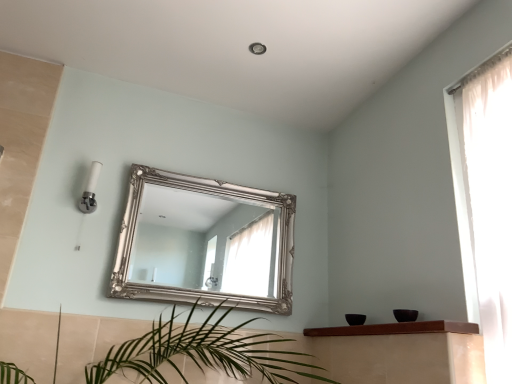
Describe the element at coordinates (205, 243) in the screenshot. I see `silver ornate mirror at center` at that location.

Find the location of a particular element. This screenshot has height=384, width=512. silver ornate mirror at center is located at coordinates (205, 243).

The height and width of the screenshot is (384, 512). What do you see at coordinates (396, 329) in the screenshot? I see `brown wooden shelf at lower center` at bounding box center [396, 329].

At what (x,y) coordinates should I click in order to perform the action: click on brown wooden shelf at lower center. Please return your answer as a coordinate pair (x, y). Looking at the image, I should click on (396, 329).

The width and height of the screenshot is (512, 384). Identify the location of silver ornate mirror at center. (205, 243).

Which object is positioned more to the left, silver ornate mirror at center or brown wooden shelf at lower center?

From the viewer's perspective, silver ornate mirror at center appears more on the left side.

Considering their positions, is silver ornate mirror at center located in front of or behind brown wooden shelf at lower center?

silver ornate mirror at center is behind brown wooden shelf at lower center.

Is point (153, 224) closer or farther from the camera than point (459, 332)?

Clearly, point (153, 224) is more distant from the camera than point (459, 332).

From the image's perspective, would you say silver ornate mirror at center is shown under brown wooden shelf at lower center?

→ No, from the image's perspective, silver ornate mirror at center is not beneath brown wooden shelf at lower center.

From a real-world perspective, between silver ornate mirror at center and brown wooden shelf at lower center, who is vertically lower?

brown wooden shelf at lower center, from a real-world perspective.

Between silver ornate mirror at center and brown wooden shelf at lower center, which one has smaller width?

silver ornate mirror at center is thinner.

Looking at this image, is silver ornate mirror at center taller or shorter than brown wooden shelf at lower center?

Clearly, silver ornate mirror at center is taller compared to brown wooden shelf at lower center.

Considering the relative sizes of silver ornate mirror at center and brown wooden shelf at lower center in the image provided, is silver ornate mirror at center bigger than brown wooden shelf at lower center?

Yes.

Is brown wooden shelf at lower center completely or partially inside silver ornate mirror at center?

Definitely not — brown wooden shelf at lower center is not inside silver ornate mirror at center.

Can you see silver ornate mirror at center touching brown wooden shelf at lower center?

No, silver ornate mirror at center is not with brown wooden shelf at lower center.

Is silver ornate mirror at center turned away from brown wooden shelf at lower center?

silver ornate mirror at center does not have its back to brown wooden shelf at lower center.

How many degrees apart are the facing directions of silver ornate mirror at center and brown wooden shelf at lower center?

The facing directions of silver ornate mirror at center and brown wooden shelf at lower center are 89 degrees apart.

Locate an element on the screen. This screenshot has height=384, width=512. mirror that is on the left side of brown wooden shelf at lower center is located at coordinates (205, 243).

Considering the relative positions of brown wooden shelf at lower center and silver ornate mirror at center in the image provided, is brown wooden shelf at lower center to the right of silver ornate mirror at center from the viewer's perspective?

Yes.

From the picture: Is the depth of brown wooden shelf at lower center greater than that of silver ornate mirror at center?

No, it is not.

Considering the points (409, 327) and (181, 196), which point is behind, point (409, 327) or point (181, 196)?

Positioned behind is point (181, 196).

From the image's perspective, would you say brown wooden shelf at lower center is positioned over silver ornate mirror at center?

No, from the image's perspective, brown wooden shelf at lower center is not on top of silver ornate mirror at center.

From a real-world perspective, is brown wooden shelf at lower center on silver ornate mirror at center?

Actually, brown wooden shelf at lower center is physically below silver ornate mirror at center in the real world.

Considering the sizes of objects brown wooden shelf at lower center and silver ornate mirror at center in the image provided, who is wider, brown wooden shelf at lower center or silver ornate mirror at center?

brown wooden shelf at lower center.

Who is taller, brown wooden shelf at lower center or silver ornate mirror at center?

Standing taller between the two is silver ornate mirror at center.

Is brown wooden shelf at lower center smaller than silver ornate mirror at center?

Correct, brown wooden shelf at lower center occupies less space than silver ornate mirror at center.

Would you say brown wooden shelf at lower center is inside or outside silver ornate mirror at center?

The correct answer is: outside.

Are brown wooden shelf at lower center and silver ornate mirror at center far apart?

Yes.

Is brown wooden shelf at lower center looking in the opposite direction of silver ornate mirror at center?

brown wooden shelf at lower center is not turned away from silver ornate mirror at center.

What's the angular difference between brown wooden shelf at lower center and silver ornate mirror at center's facing directions?

89 degrees.

You are a GUI agent. You are given a task and a screenshot of the screen. Output one action in this format:
    pyautogui.click(x=<x>, y=<y>)
    Task: Click on the balustrade in front of the silver ornate mirror at center
    The height and width of the screenshot is (384, 512).
    Given the screenshot: What is the action you would take?
    pyautogui.click(x=396, y=329)

Locate an element on the screen. balustrade beneath the silver ornate mirror at center (from a real-world perspective) is located at coordinates (396, 329).

The width and height of the screenshot is (512, 384). I want to click on mirror above the brown wooden shelf at lower center (from a real-world perspective), so click(x=205, y=243).